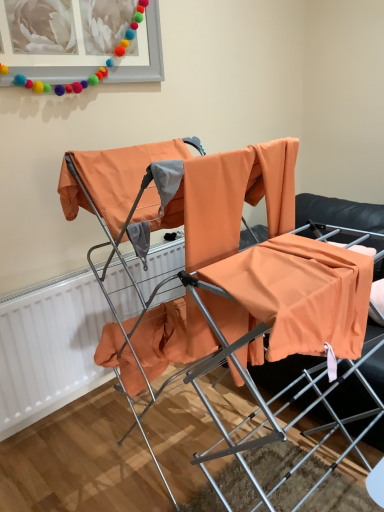
Question: Can you confirm if matte gray picture frame at upper left is shorter than orange fabric chair at center?

Choices:
 (A) no
 (B) yes

Answer: (B)

Question: Is matte gray picture frame at upper left positioned before orange fabric chair at center?

Choices:
 (A) yes
 (B) no

Answer: (B)

Question: Are matte gray picture frame at upper left and orange fabric chair at center beside each other?

Choices:
 (A) no
 (B) yes

Answer: (A)

Question: Considering the relative sizes of matte gray picture frame at upper left and orange fabric chair at center in the image provided, is matte gray picture frame at upper left thinner than orange fabric chair at center?

Choices:
 (A) no
 (B) yes

Answer: (B)

Question: From the image's perspective, does matte gray picture frame at upper left appear higher than orange fabric chair at center?

Choices:
 (A) no
 (B) yes

Answer: (B)

Question: Can you confirm if matte gray picture frame at upper left is wider than orange fabric chair at center?

Choices:
 (A) no
 (B) yes

Answer: (A)

Question: Does orange fabric chair at center appear on the left side of matte gray picture frame at upper left?

Choices:
 (A) yes
 (B) no

Answer: (B)

Question: Is orange fabric chair at center completely or partially outside of matte gray picture frame at upper left?

Choices:
 (A) no
 (B) yes

Answer: (B)

Question: Can you confirm if orange fabric chair at center is taller than matte gray picture frame at upper left?

Choices:
 (A) yes
 (B) no

Answer: (A)

Question: Is orange fabric chair at center looking in the opposite direction of matte gray picture frame at upper left?

Choices:
 (A) yes
 (B) no

Answer: (B)

Question: From a real-world perspective, is orange fabric chair at center below matte gray picture frame at upper left?

Choices:
 (A) yes
 (B) no

Answer: (A)

Question: Can you confirm if orange fabric chair at center is bigger than matte gray picture frame at upper left?

Choices:
 (A) yes
 (B) no

Answer: (A)

Question: Is white matte radiator at left completely or partially outside of orange fabric chair at center?

Choices:
 (A) no
 (B) yes

Answer: (B)